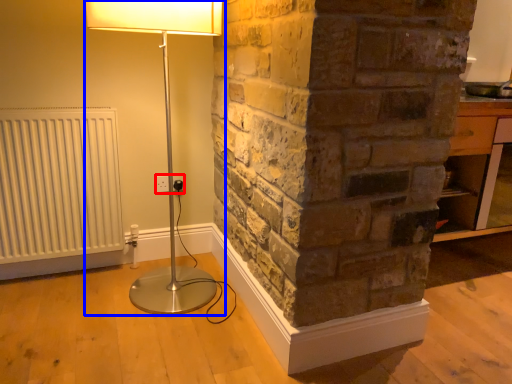
Question: Which object is further to the camera taking this photo, electric outlet (highlighted by a red box) or lamp (highlighted by a blue box)?

Choices:
 (A) electric outlet
 (B) lamp

Answer: (A)